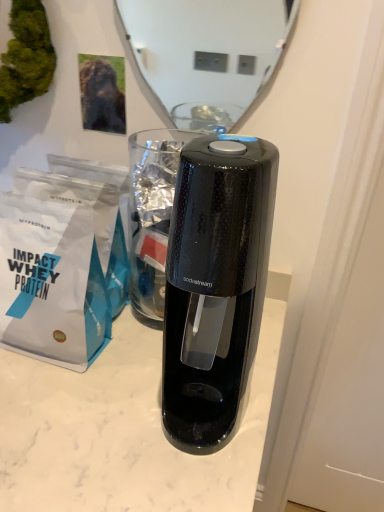
Question: From the image's perspective, does white matte paper bag at left appear lower than glossy white mirror at upper center?

Choices:
 (A) no
 (B) yes

Answer: (B)

Question: From a real-world perspective, does white matte paper bag at left stand above glossy white mirror at upper center?

Choices:
 (A) no
 (B) yes

Answer: (A)

Question: From a real-world perspective, is white matte paper bag at left under glossy white mirror at upper center?

Choices:
 (A) no
 (B) yes

Answer: (B)

Question: Can you confirm if white matte paper bag at left is positioned to the left of glossy white mirror at upper center?

Choices:
 (A) no
 (B) yes

Answer: (B)

Question: Is white matte paper bag at left at the right side of glossy white mirror at upper center?

Choices:
 (A) no
 (B) yes

Answer: (A)

Question: Is glossy white mirror at upper center a part of white matte paper bag at left?

Choices:
 (A) no
 (B) yes

Answer: (A)

Question: Does green moss at upper left contain glossy white mirror at upper center?

Choices:
 (A) no
 (B) yes

Answer: (A)

Question: Are green moss at upper left and glossy white mirror at upper center located far from each other?

Choices:
 (A) yes
 (B) no

Answer: (A)

Question: Can you confirm if green moss at upper left is wider than glossy white mirror at upper center?

Choices:
 (A) no
 (B) yes

Answer: (B)

Question: Is green moss at upper left positioned beyond the bounds of glossy white mirror at upper center?

Choices:
 (A) no
 (B) yes

Answer: (B)

Question: Does green moss at upper left have a greater height compared to glossy white mirror at upper center?

Choices:
 (A) yes
 (B) no

Answer: (B)

Question: Considering the relative positions of green moss at upper left and glossy white mirror at upper center in the image provided, is green moss at upper left to the left of glossy white mirror at upper center from the viewer's perspective?

Choices:
 (A) yes
 (B) no

Answer: (A)

Question: From a real-world perspective, is glossy white mirror at upper center positioned under white matte paper bag at left based on gravity?

Choices:
 (A) no
 (B) yes

Answer: (A)